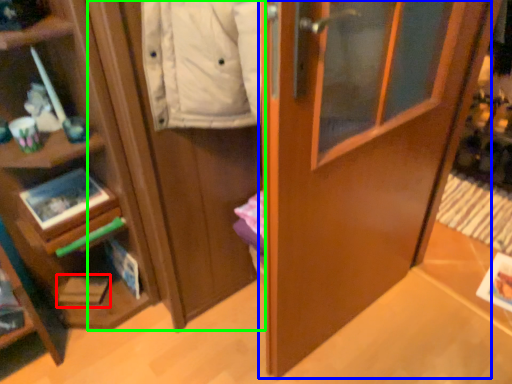
Question: Based on their relative distances, which object is nearer to magazine (highlighted by a red box)? Choose from door (highlighted by a blue box) and cabinetry (highlighted by a green box).

Choices:
 (A) door
 (B) cabinetry

Answer: (B)